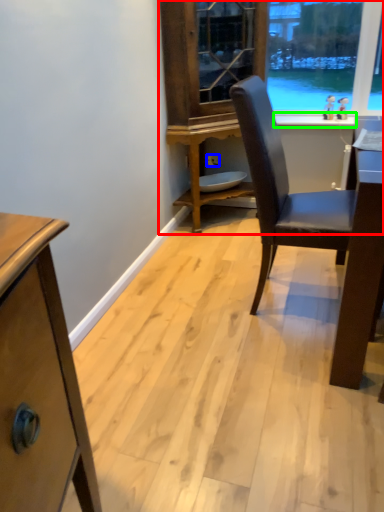
Question: Considering the real-world distances, which object is closest to dresser (highlighted by a red box)? power outlet (highlighted by a blue box) or window sill (highlighted by a green box).

Choices:
 (A) power outlet
 (B) window sill

Answer: (B)